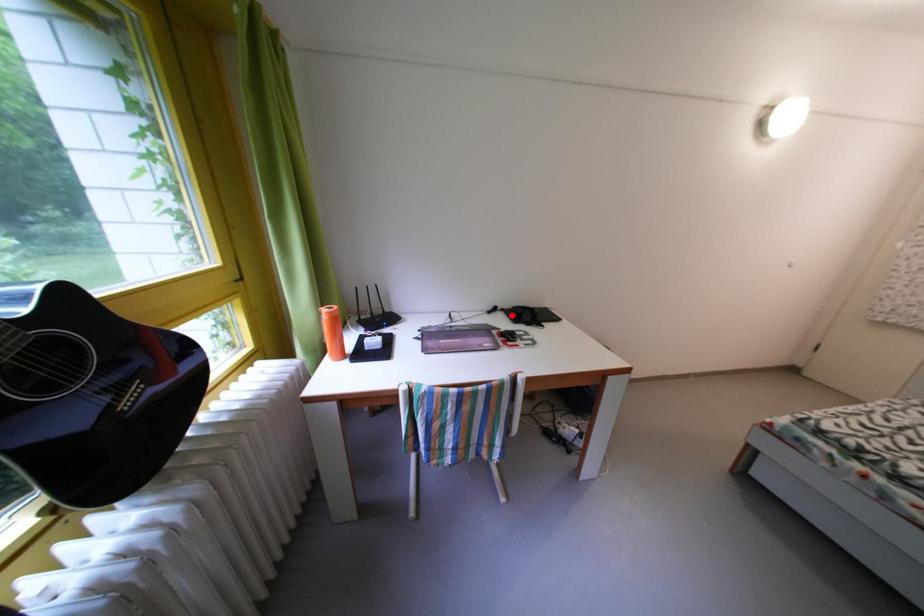
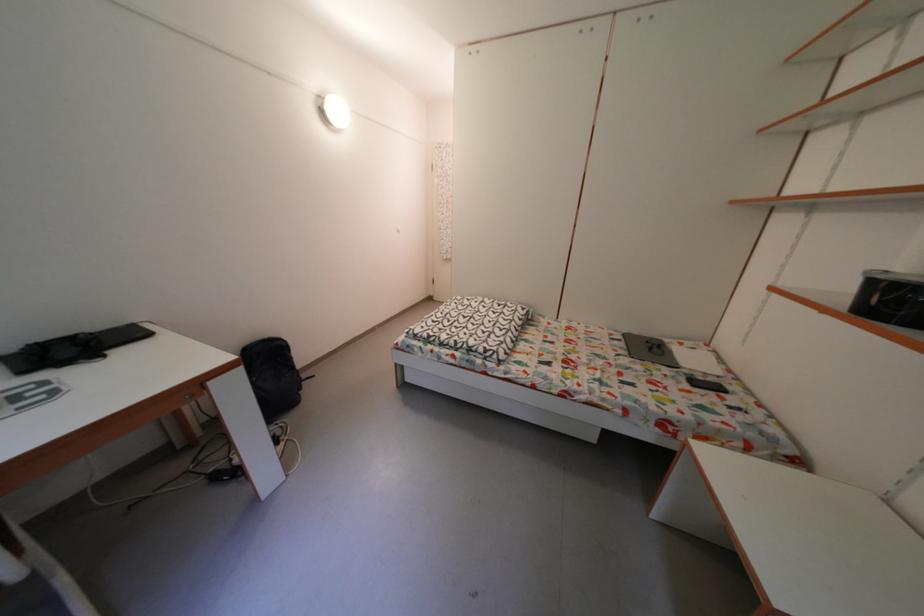
Locate, in the second image, the point that corresponds to the highlighted location in the first image.

(6, 363)